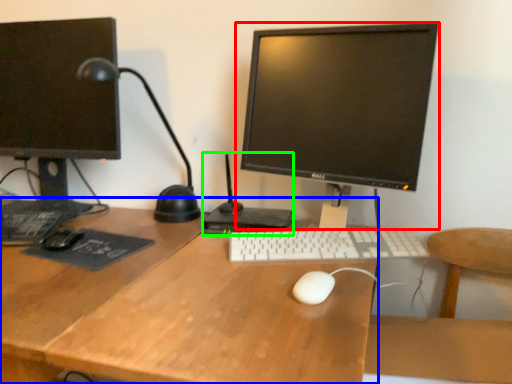
Question: Based on their relative distances, which object is nearer to computer monitor (highlighted by a red box)? Choose from desk (highlighted by a blue box) and computer (highlighted by a green box).

Choices:
 (A) desk
 (B) computer

Answer: (B)